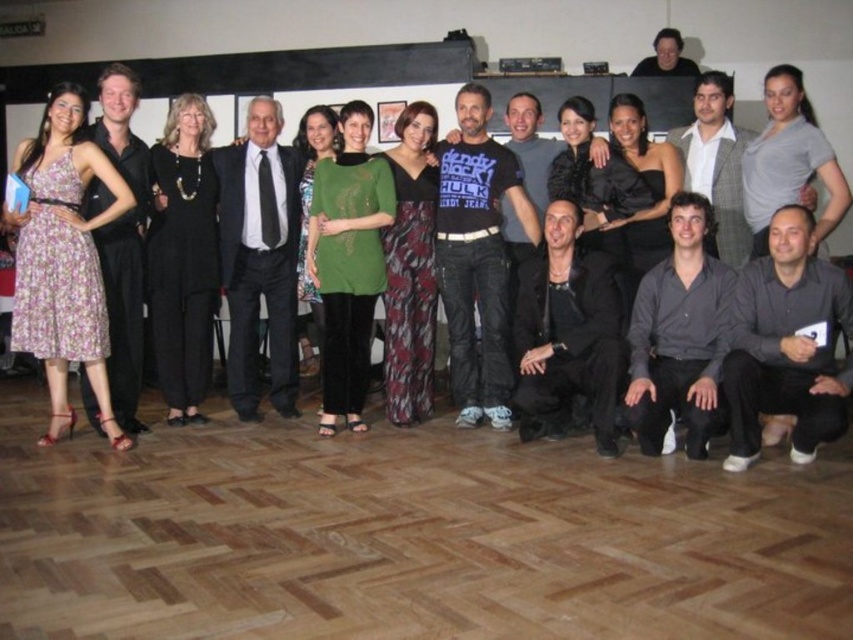
Does black leather jacket at lower center appear over dark gray shirt at lower right?

No.

Does black leather jacket at lower center have a smaller size compared to dark gray shirt at lower right?

Actually, black leather jacket at lower center might be larger than dark gray shirt at lower right.

Describe the element at coordinates (567, 333) in the screenshot. I see `black leather jacket at lower center` at that location.

I want to click on black leather jacket at lower center, so click(x=567, y=333).

Is point (32, 268) behind point (289, 289)?

No, (32, 268) is closer to viewer.

Is floral dress at left positioned in front of black satin suit at center?

Yes, floral dress at left is in front of black satin suit at center.

Measure the distance between point (54, 160) and camera.

Point (54, 160) and camera are 4.01 meters apart.

Where is `floral dress at left`? The height and width of the screenshot is (640, 853). floral dress at left is located at coordinates (64, 259).

Does floral dress at left have a smaller size compared to black matte shirt at upper center?

Actually, floral dress at left might be larger than black matte shirt at upper center.

How distant is floral dress at left from black matte shirt at upper center?

A distance of 4.13 meters exists between floral dress at left and black matte shirt at upper center.

Locate an element on the screen. floral dress at left is located at coordinates (x=64, y=259).

Where is `floral dress at left`? floral dress at left is located at coordinates (64, 259).